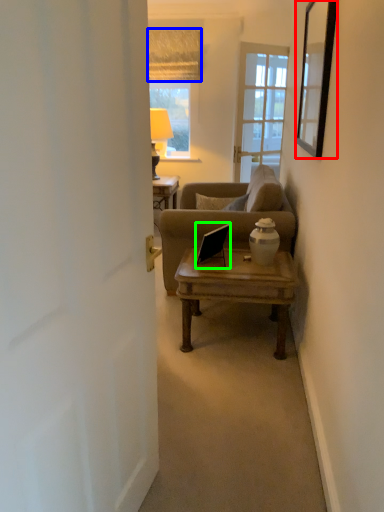
Question: Which object is the closest to the picture frame (highlighted by a red box)? Choose among these: curtain (highlighted by a blue box) or laptop (highlighted by a green box).

Choices:
 (A) curtain
 (B) laptop

Answer: (B)